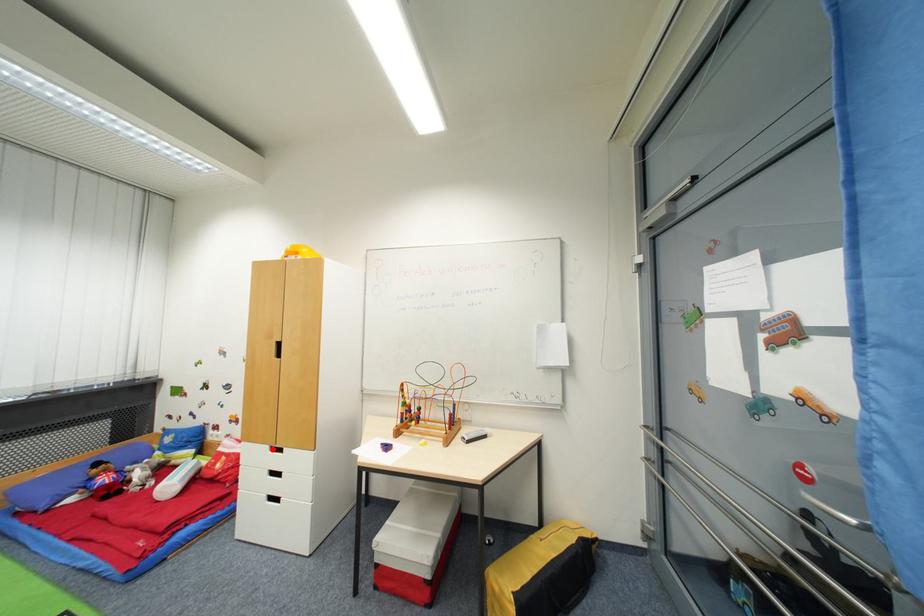
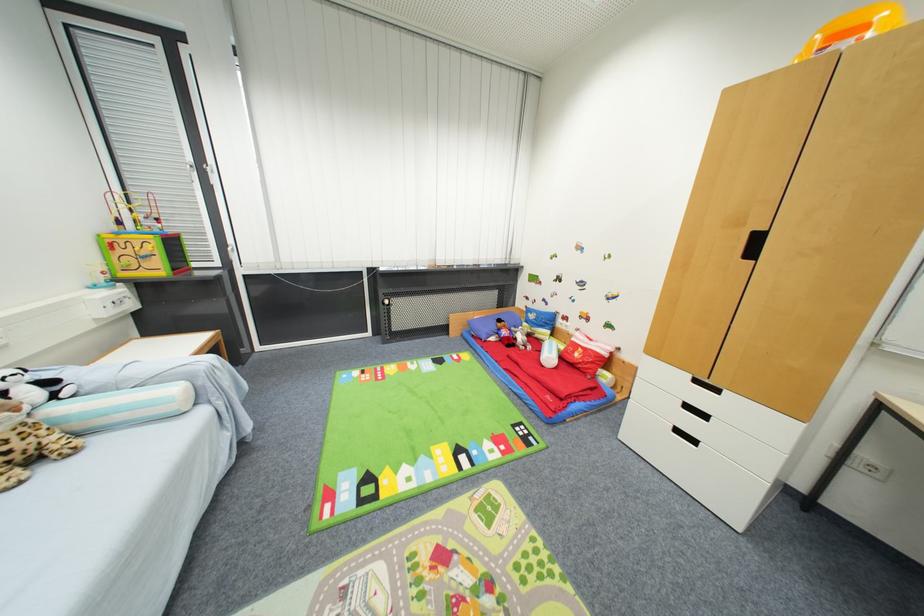
The point at the highlighted location is marked in the first image. Where is the corresponding point in the second image?

(695, 378)